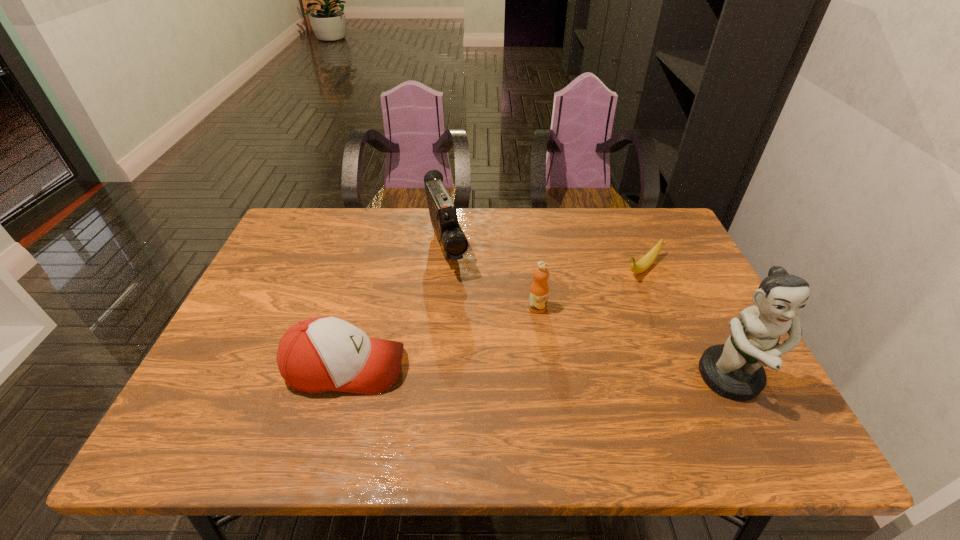
Locate which object ranks fourth in proximity to the orange juice. Please provide its 2D coordinates. Your answer should be formatted as a tuple, i.e. [(x, y)], where the tuple contains the x and y coordinates of a point satisfying the conditions above.

[(734, 370)]

Choose which object is the nearest neighbor to the second tallest object. Please provide its 2D coordinates. Your answer should be formatted as a tuple, i.e. [(x, y)], where the tuple contains the x and y coordinates of a point satisfying the conditions above.

[(539, 289)]